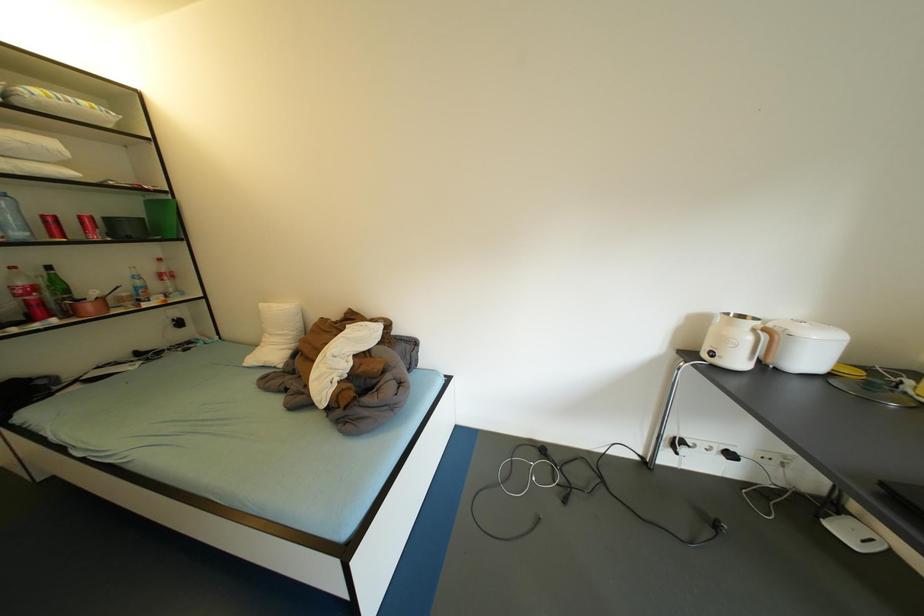
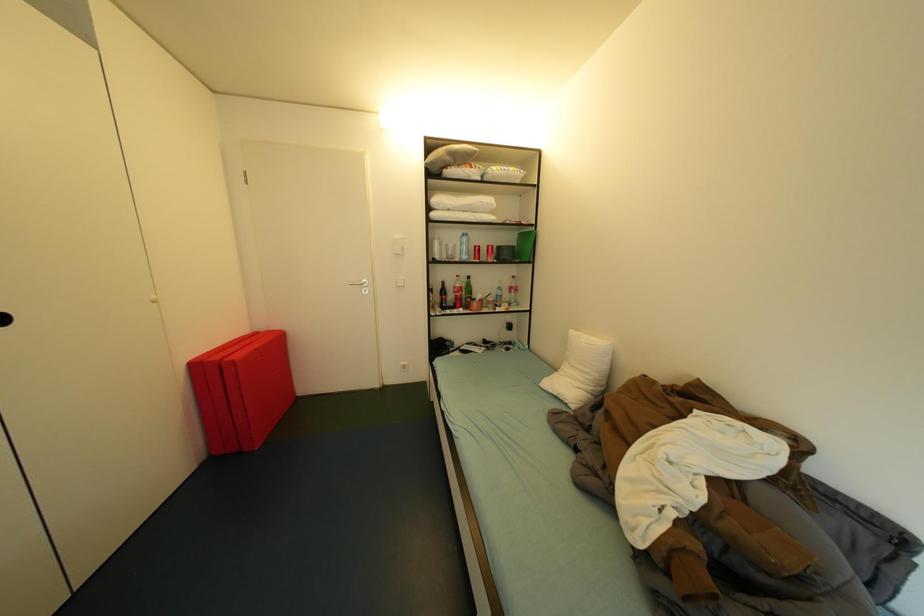
Question: The first image is from the beginning of the video and the second image is from the end. How did the camera likely rotate when shooting the video?

Choices:
 (A) Left
 (B) Right
 (C) Up
 (D) Down

Answer: (A)